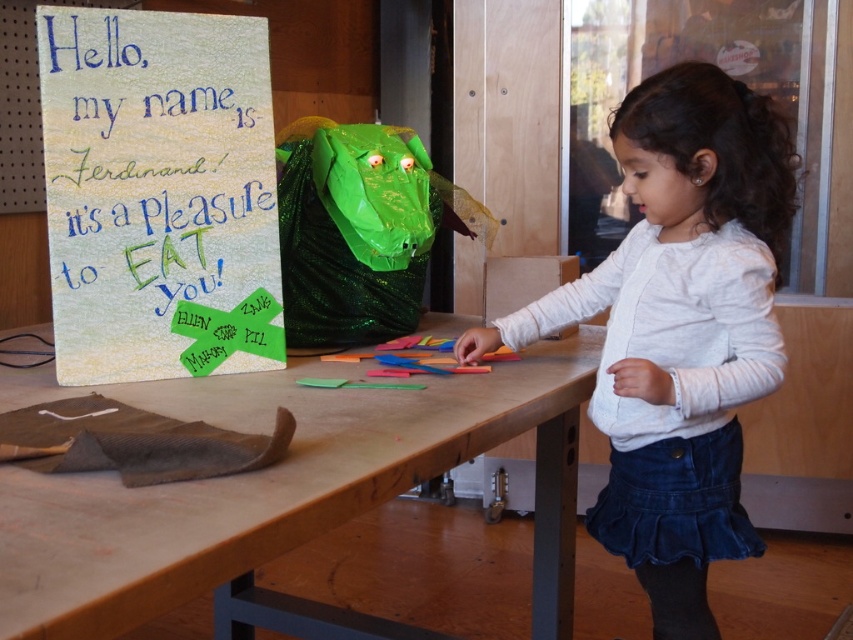
Question: Does wooden table at center appear on the left side of textured paper sign at upper left?

Choices:
 (A) yes
 (B) no

Answer: (B)

Question: Is white soft sweater at center below textured paper sign at upper left?

Choices:
 (A) yes
 (B) no

Answer: (A)

Question: Considering the relative positions of white soft sweater at center and textured paper sign at upper left in the image provided, where is white soft sweater at center located with respect to textured paper sign at upper left?

Choices:
 (A) below
 (B) above

Answer: (A)

Question: Which is farther from the white soft sweater at center?

Choices:
 (A) wooden table at center
 (B) textured paper sign at upper left

Answer: (B)

Question: Which of the following is the closest to the observer?

Choices:
 (A) (138, 189)
 (B) (294, 454)

Answer: (B)

Question: Based on their relative distances, which object is nearer to the textured paper sign at upper left?

Choices:
 (A) wooden table at center
 (B) white soft sweater at center

Answer: (A)